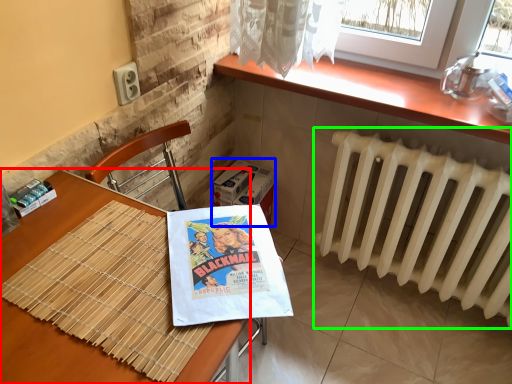
Question: Which object is the farthest from table (highlighted by a red box)? Choose among these: cardboard box (highlighted by a blue box) or radiator (highlighted by a green box).

Choices:
 (A) cardboard box
 (B) radiator

Answer: (B)